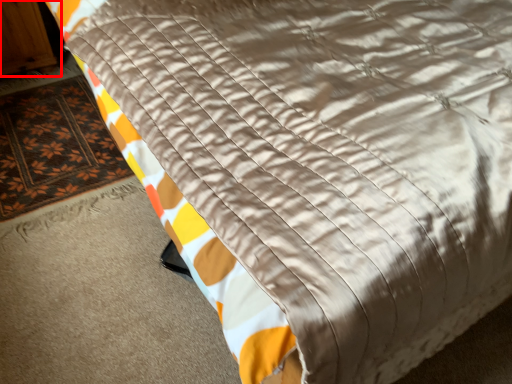
Question: Where is armoire (annotated by the red box) located in relation to mat in the image?

Choices:
 (A) left
 (B) right

Answer: (A)